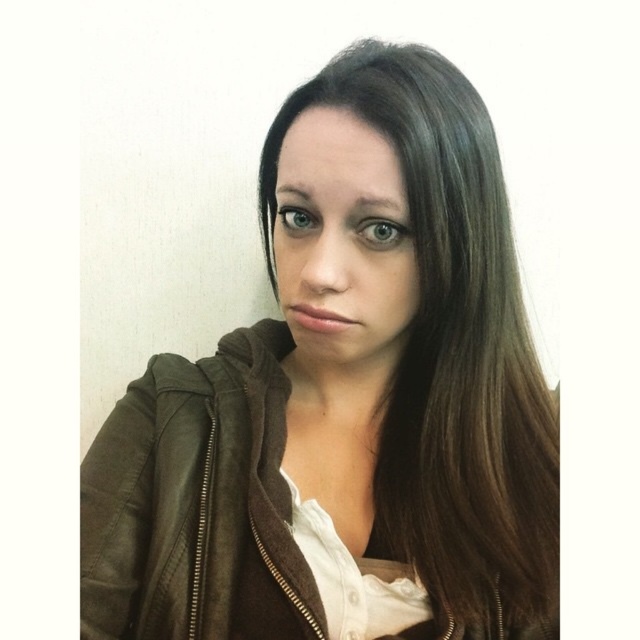
You are a fashion designer trying to create a new outfit for the person in the image. Given that the leather jacket at center and the matte brown hair at center are both at the center of the image, which one has a greater width?

The leather jacket at center has a greater width than the matte brown hair at center.

You are an artist sketching the person in the image. You notice two points marked on their jacket. The first point is at coordinate point (252, 388) and the second is at point (417, 285). Which point is closer to the viewer?

Point (417, 285) is closer to the viewer because point (252, 388) is behind it.

You are a fashion designer assessing a model wearing the leather jacket at center and matte brown hair at center. Based on their height relationship, which clothing length would you recommend to ensure the jacket covers the hair appropriately?

The leather jacket at center is taller than matte brown hair at center, so a jacket with a longer length would ensure it covers the hair appropriately.